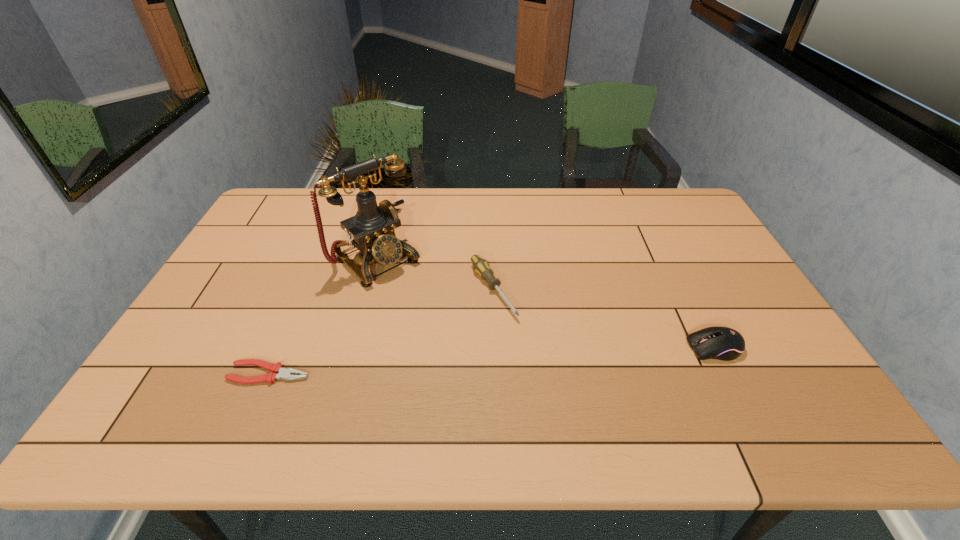
Where is `object that is the closest one to the pliers`? object that is the closest one to the pliers is located at coordinates (372, 230).

Where is `vacant space that satisfies the following two spatial constraints: 1. on the front side of the third object from left to right; 2. on the left side of the telephone`? This screenshot has height=540, width=960. vacant space that satisfies the following two spatial constraints: 1. on the front side of the third object from left to right; 2. on the left side of the telephone is located at coordinates (370, 291).